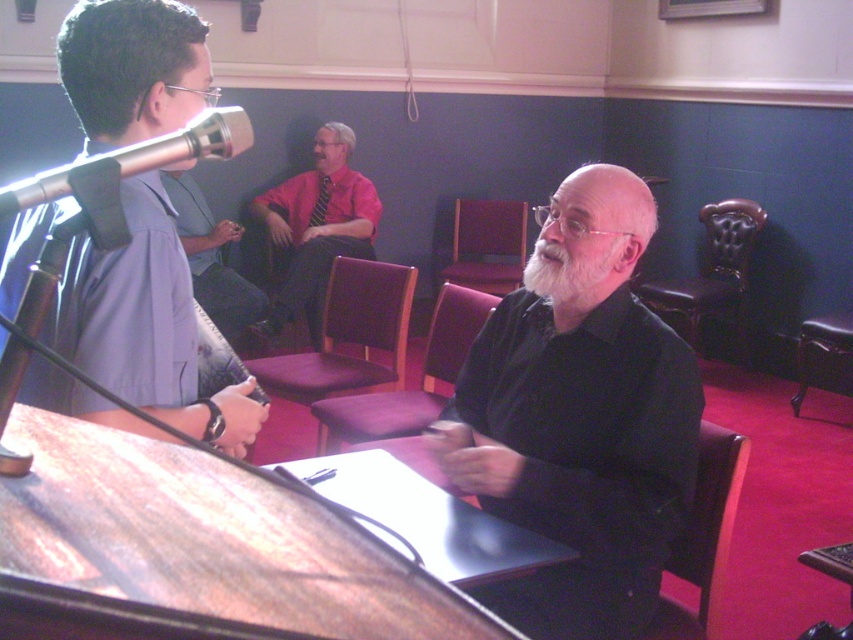
You are standing at the point marked as point [347,336] in the image. What object are you sitting on?

You are sitting on the purple leather chair at center.

You are standing at point (178, 144) and want to move to point (355, 284). Is the path between them clear?

The path between point (178, 144) and point (355, 284) is clear because point (355, 284) is behind point (178, 144), so there are no obstructions in between.

You are a photographer setting up for a group photo. You need to position a 1.2 meter wide backdrop between the black matte shirt at center and the purple fabric chair at center. Will there be enough space to place it without moving either object?

The black matte shirt at center and purple fabric chair at center are 1.15 meters apart. Since the backdrop is 1.2 meters wide, it would be slightly too wide to fit between them without moving either object.